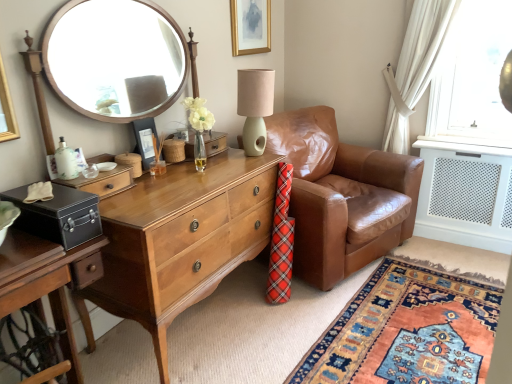
Locate an element on the screen. vacant space underneath light brown wood desk at center (from a real-world perspective) is located at coordinates (198, 320).